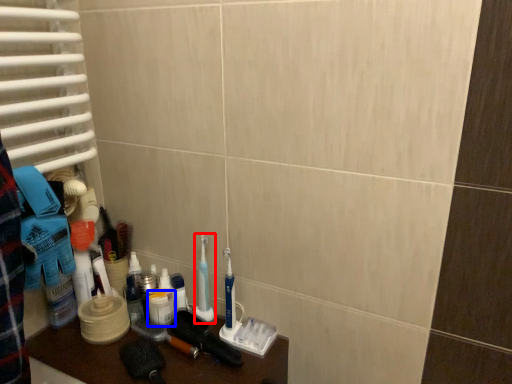
Question: Which point is further to the camera, toothbrush (highlighted by a red box) or mouthwash (highlighted by a blue box)?

Choices:
 (A) toothbrush
 (B) mouthwash

Answer: (B)